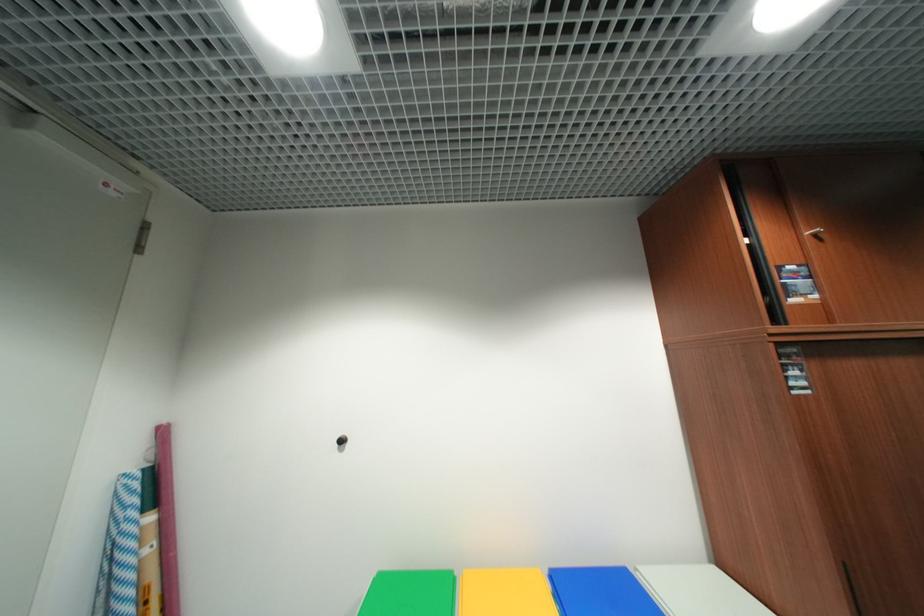
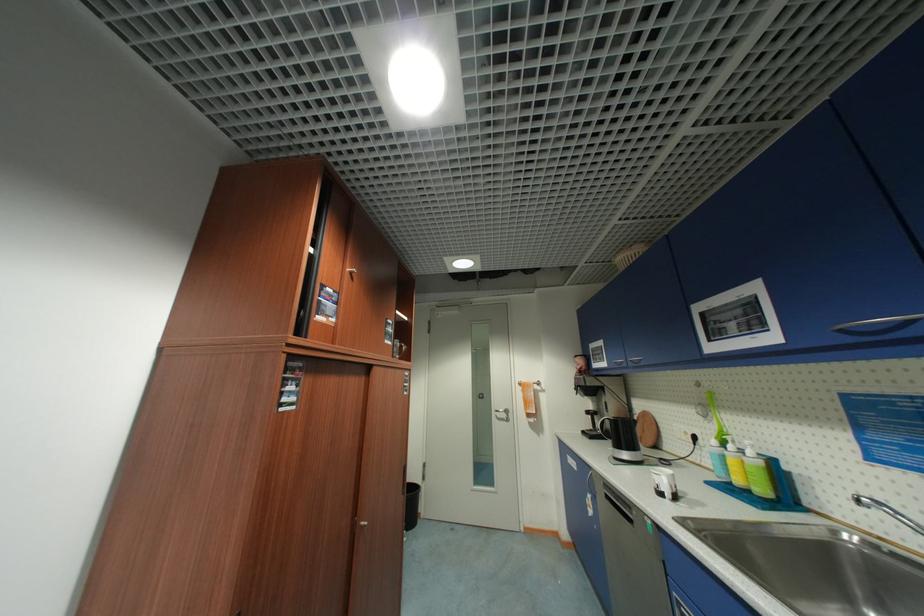
The images are taken continuously from a first-person perspective. In which direction is your viewpoint rotating?

The camera's rotation is toward right-up.